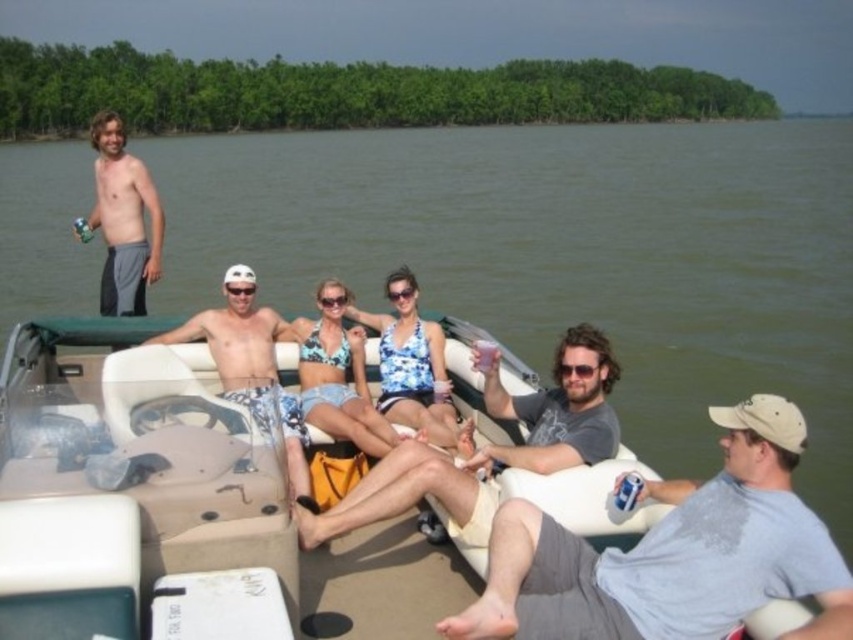
You are standing on the pontoon boat and want to reach the shiny gray shorts at left from the green water at upper center. Given that the distance between them is 86.32 feet, can you walk directly to the shorts without moving around any obstacles?

The green water at upper center is 86.32 feet from the shiny gray shorts at left, so you can walk directly to the shorts as there are no obstacles mentioned in the scene description between them.

You are standing on the pontoon boat and notice the green water at upper center and the shiny gray shorts at left. Which object is positioned higher from the ground?

The green water at upper center is located above the shiny gray shorts at left, so it is positioned higher from the ground.